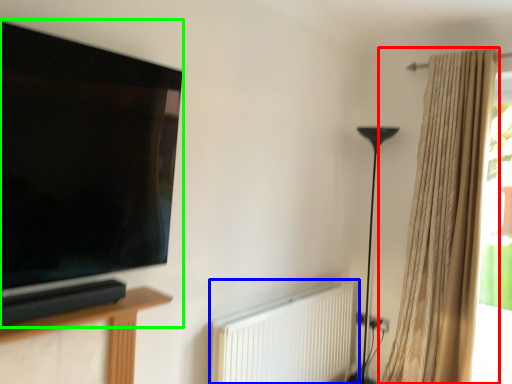
Question: Estimate the real-world distances between objects in this image. Which object is farther from curtain (highlighted by a red box), radiator (highlighted by a blue box) or television (highlighted by a green box)?

Choices:
 (A) radiator
 (B) television

Answer: (B)